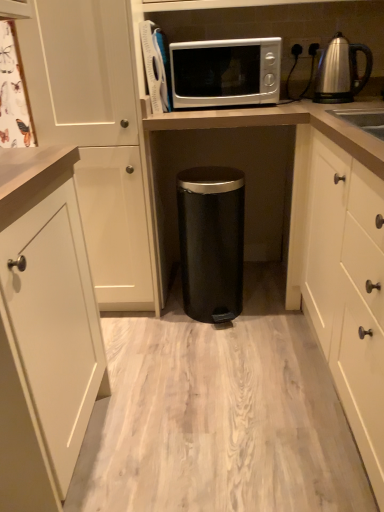
Question: Should I look upward or downward to see white matte cabinet at left, marked as the 2th cabinetry in a right-to-left arrangement?

Choices:
 (A) down
 (B) up

Answer: (B)

Question: Is white matte cabinet at right, which appears as the first cabinetry when viewed from the right, not near satin silver kettle at upper right?

Choices:
 (A) yes
 (B) no

Answer: (B)

Question: From a real-world perspective, is white matte cabinet at right, which appears as the first cabinetry when viewed from the right, on top of satin silver kettle at upper right?

Choices:
 (A) no
 (B) yes

Answer: (A)

Question: From a real-world perspective, is white matte cabinet at right, acting as the 2th cabinetry starting from the left, located beneath satin silver kettle at upper right?

Choices:
 (A) yes
 (B) no

Answer: (A)

Question: Is white matte cabinet at right, acting as the 2th cabinetry starting from the left, facing towards satin silver kettle at upper right?

Choices:
 (A) no
 (B) yes

Answer: (A)

Question: Can you confirm if white matte cabinet at right, which appears as the first cabinetry when viewed from the right, is smaller than satin silver kettle at upper right?

Choices:
 (A) no
 (B) yes

Answer: (A)

Question: Is white matte cabinet at right, which appears as the first cabinetry when viewed from the right, outside of satin silver kettle at upper right?

Choices:
 (A) no
 (B) yes

Answer: (B)

Question: Is the depth of black matte trash can at center, acting as the second appliance starting from the left, greater than that of white matte cabinet at left, the first cabinetry in the left-to-right sequence?

Choices:
 (A) yes
 (B) no

Answer: (A)

Question: Does black matte trash can at center, which is the 1th appliance in bottom-to-top order, have a greater width compared to white matte cabinet at left, marked as the 2th cabinetry in a right-to-left arrangement?

Choices:
 (A) yes
 (B) no

Answer: (B)

Question: Is black matte trash can at center, which is counted as the second appliance, starting from the top, completely or partially outside of white matte cabinet at left, marked as the 2th cabinetry in a right-to-left arrangement?

Choices:
 (A) yes
 (B) no

Answer: (A)

Question: Is black matte trash can at center, acting as the second appliance starting from the left, beside white matte cabinet at left, marked as the 2th cabinetry in a right-to-left arrangement?

Choices:
 (A) yes
 (B) no

Answer: (B)

Question: From a real-world perspective, is black matte trash can at center, placed as the first appliance when sorted from right to left, on top of white matte cabinet at left, marked as the 2th cabinetry in a right-to-left arrangement?

Choices:
 (A) yes
 (B) no

Answer: (B)

Question: Is black matte trash can at center, which is the 1th appliance in bottom-to-top order, not near white matte cabinet at left, the first cabinetry in the left-to-right sequence?

Choices:
 (A) yes
 (B) no

Answer: (B)

Question: Considering the relative sizes of black matte trash can at center, which is the 1th appliance in bottom-to-top order, and satin silver microwave at upper center, the second appliance positioned from the bottom, in the image provided, is black matte trash can at center, which is the 1th appliance in bottom-to-top order, thinner than satin silver microwave at upper center, the second appliance positioned from the bottom,?

Choices:
 (A) no
 (B) yes

Answer: (B)